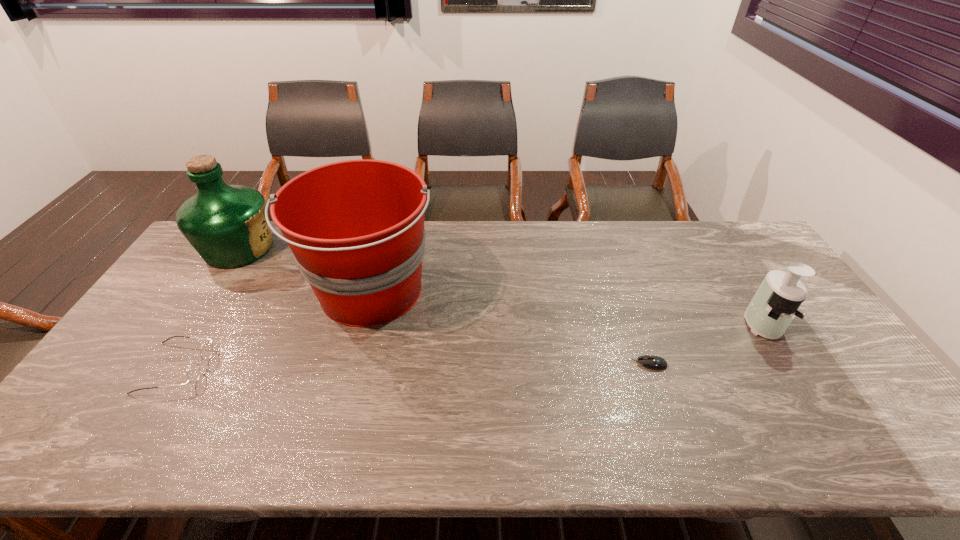
At what (x,y) coordinates should I click in order to perform the action: click on free point located through the lenses of the second shortest object. Please return your answer as a coordinate pair (x, y). The image size is (960, 540). Looking at the image, I should click on coord(351,368).

The image size is (960, 540). Find the location of `vacant space located on the front of the computer mouse`. vacant space located on the front of the computer mouse is located at coordinates (666, 412).

The height and width of the screenshot is (540, 960). In order to click on bucket at the far edge in this screenshot , I will do `click(356, 230)`.

Image resolution: width=960 pixels, height=540 pixels. I want to click on liquor present at the far edge, so click(226, 224).

Locate an element on the screen. This screenshot has height=540, width=960. liquor at the left edge is located at coordinates (226, 224).

Where is `spectacles situated at the left edge`? This screenshot has width=960, height=540. spectacles situated at the left edge is located at coordinates (193, 373).

Find the location of a particular element. object located at the right edge is located at coordinates (775, 304).

Locate an element on the screen. The image size is (960, 540). object at the far left corner is located at coordinates click(x=226, y=224).

I want to click on vacant region at the far edge of the desktop, so click(695, 262).

You are a GUI agent. You are given a task and a screenshot of the screen. Output one action in this format:
    pyautogui.click(x=<x>, y=<y>)
    Task: Click on the free location at the left edge
    This screenshot has height=540, width=960.
    Given the screenshot: What is the action you would take?
    (x=204, y=277)